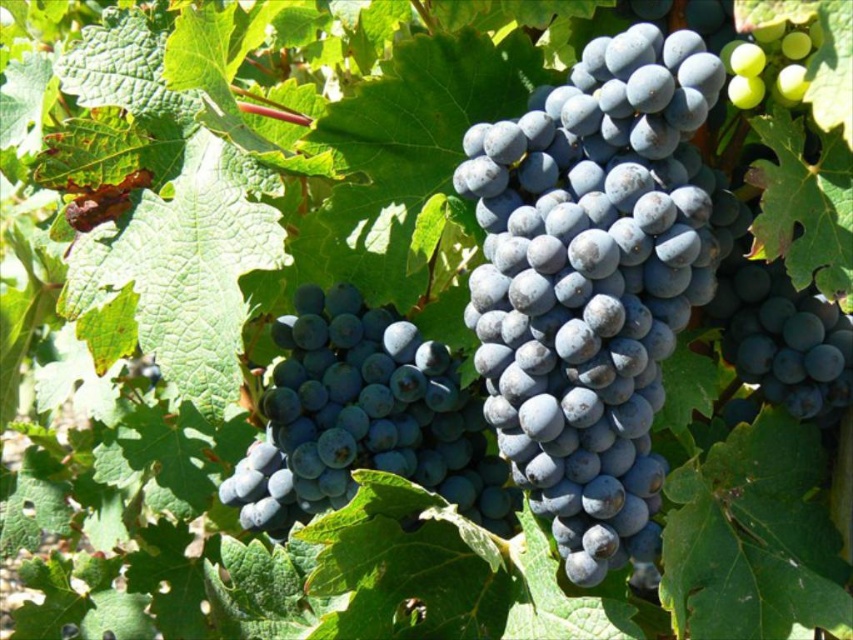
You are a fruit picker who needs to harvest grapes. You have a basket that can hold grapes within a 10 inch radius. If you want to collect both the matte dark blue grapes at center and the shiny dark blue grapes at center, will your basket be able to hold them both?

The distance between the matte dark blue grapes at center and the shiny dark blue grapes at center is 10.85 inches. Since the basket can only hold grapes within a 10 inch radius, the grapes are too far apart to fit within the basket simultaneously.

You are a farmer checking the grapevines and notice the matte dark blue grapes at center and the green matte grape at upper right. Which grape cluster is positioned to the left when viewed from your perspective?

The matte dark blue grapes at center is positioned to the left of the green matte grape at upper right.